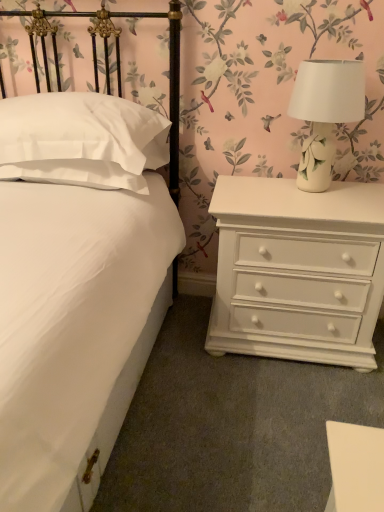
Locate an element on the screen. Image resolution: width=384 pixels, height=512 pixels. free area below white ceramic lamp at upper right (from a real-world perspective) is located at coordinates (322, 189).